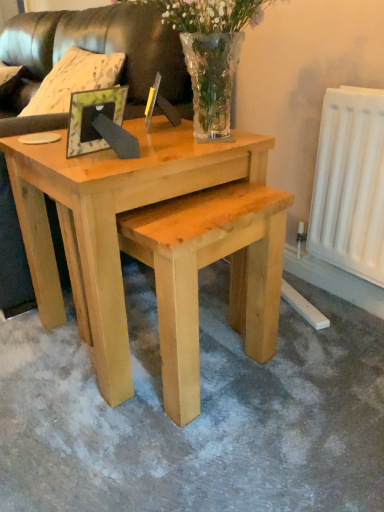
Question: From a real-world perspective, is leather couch at upper left, which is the 2th couch in front-to-back order, located beneath clear glass vase at upper center?

Choices:
 (A) no
 (B) yes

Answer: (B)

Question: Can you see leather couch at upper left, which is the 2th couch in front-to-back order, touching clear glass vase at upper center?

Choices:
 (A) no
 (B) yes

Answer: (A)

Question: Is leather couch at upper left, which is the 2th couch in front-to-back order, closer to camera compared to clear glass vase at upper center?

Choices:
 (A) yes
 (B) no

Answer: (B)

Question: Could you tell me if leather couch at upper left, the first couch viewed from the back, is facing clear glass vase at upper center?

Choices:
 (A) yes
 (B) no

Answer: (B)

Question: From the image's perspective, is leather couch at upper left, the 1th couch from the front, located above or below clear glass vase at upper center?

Choices:
 (A) above
 (B) below

Answer: (A)

Question: Is leather couch at upper left, the 1th couch from the front, bigger or smaller than clear glass vase at upper center?

Choices:
 (A) small
 (B) big

Answer: (B)

Question: In terms of height, does leather couch at upper left, placed as the 2th couch when sorted from back to front, look taller or shorter compared to clear glass vase at upper center?

Choices:
 (A) short
 (B) tall

Answer: (B)

Question: Is leather couch at upper left, the 1th couch from the front, in front of or behind clear glass vase at upper center in the image?

Choices:
 (A) front
 (B) behind

Answer: (B)

Question: Is green leafy frame at center taller or shorter than natural wood coffee table at center?

Choices:
 (A) short
 (B) tall

Answer: (A)

Question: From a real-world perspective, is green leafy frame at center above or below natural wood coffee table at center?

Choices:
 (A) below
 (B) above

Answer: (B)

Question: Is green leafy frame at center inside or outside of natural wood coffee table at center?

Choices:
 (A) inside
 (B) outside

Answer: (B)

Question: In the image, is green leafy frame at center positioned in front of or behind natural wood coffee table at center?

Choices:
 (A) front
 (B) behind

Answer: (B)

Question: Considering the positions of leather couch at upper left, which is the 2th couch in front-to-back order, and clear glass vase at upper center in the image, is leather couch at upper left, which is the 2th couch in front-to-back order, taller or shorter than clear glass vase at upper center?

Choices:
 (A) tall
 (B) short

Answer: (A)

Question: From the image's perspective, is leather couch at upper left, the first couch viewed from the back, positioned above or below clear glass vase at upper center?

Choices:
 (A) below
 (B) above

Answer: (B)